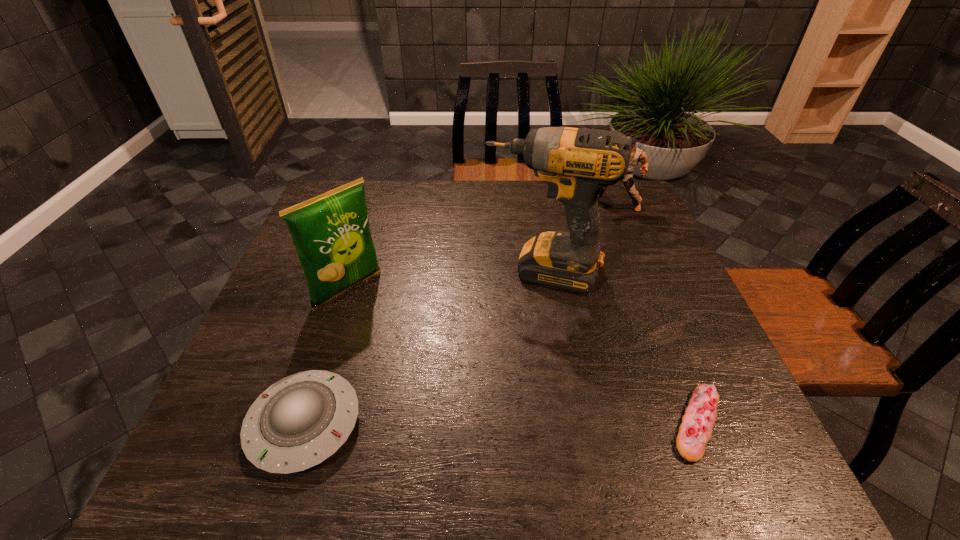
Image resolution: width=960 pixels, height=540 pixels. In order to click on blank space at the left edge of the desktop in this screenshot , I will do `click(303, 275)`.

Where is `vacant area at the right edge`? This screenshot has width=960, height=540. vacant area at the right edge is located at coordinates (699, 322).

Identify the location of vacant region at the far right corner. (601, 217).

At what (x,y) coordinates should I click in order to perform the action: click on vacant space that is in between the crisp (potato chip) and the shortest object. Please return your answer as a coordinate pair (x, y). Image resolution: width=960 pixels, height=540 pixels. Looking at the image, I should click on (522, 356).

I want to click on vacant region between the eclair and the tallest object, so click(620, 347).

Locate an element on the screen. The width and height of the screenshot is (960, 540). vacant space that is in between the crisp (potato chip) and the saucer is located at coordinates (326, 357).

I want to click on vacant space in between the farthest object and the shortest object, so click(655, 314).

Locate an element on the screen. This screenshot has height=540, width=960. blank region between the saucer and the third object from right to left is located at coordinates (423, 348).

Image resolution: width=960 pixels, height=540 pixels. I want to click on free space between the crisp (potato chip) and the eclair, so click(x=522, y=356).

Find the location of `free space between the tallest object and the crisp (potato chip)`. free space between the tallest object and the crisp (potato chip) is located at coordinates (445, 280).